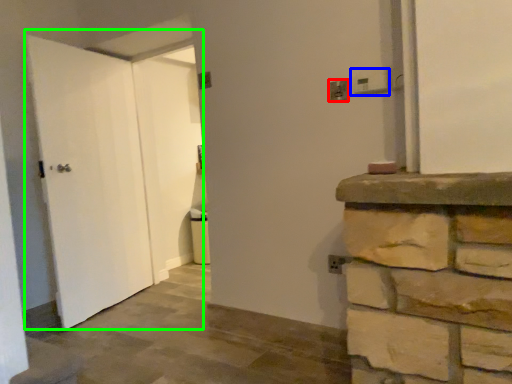
Question: Which object is positioned farthest from electric outlet (highlighted by a red box)? Select from electric outlet (highlighted by a blue box) and door (highlighted by a green box).

Choices:
 (A) electric outlet
 (B) door

Answer: (B)